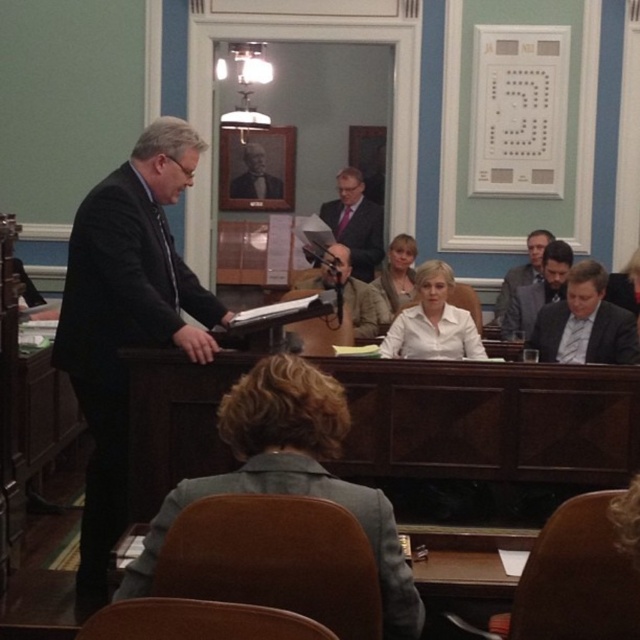
Question: In this image, where is light beige jacket at center located relative to brown wooden frame at center?

Choices:
 (A) right
 (B) left

Answer: (A)

Question: Which point appears farthest from the camera in this image?

Choices:
 (A) (548, 296)
 (B) (253, 173)
 (C) (342, 236)
 (D) (269, 188)

Answer: (D)

Question: Which object appears closest to the camera in this image?

Choices:
 (A) white matte shirt at center
 (B) dark gray suit at center
 (C) dark gray fabric business suit at right
 (D) light brown hair at center

Answer: (A)

Question: Which object appears closest to the camera in this image?

Choices:
 (A) gray suit at right
 (B) white matte shirt at center
 (C) matte black suit at center
 (D) light brown hair at center

Answer: (B)

Question: Can you confirm if light beige jacket at center is bigger than dark gray suit at center?

Choices:
 (A) yes
 (B) no

Answer: (A)

Question: Considering the relative positions of dark gray suit at right and dark suit jacket at center in the image provided, where is dark gray suit at right located with respect to dark suit jacket at center?

Choices:
 (A) above
 (B) below

Answer: (B)